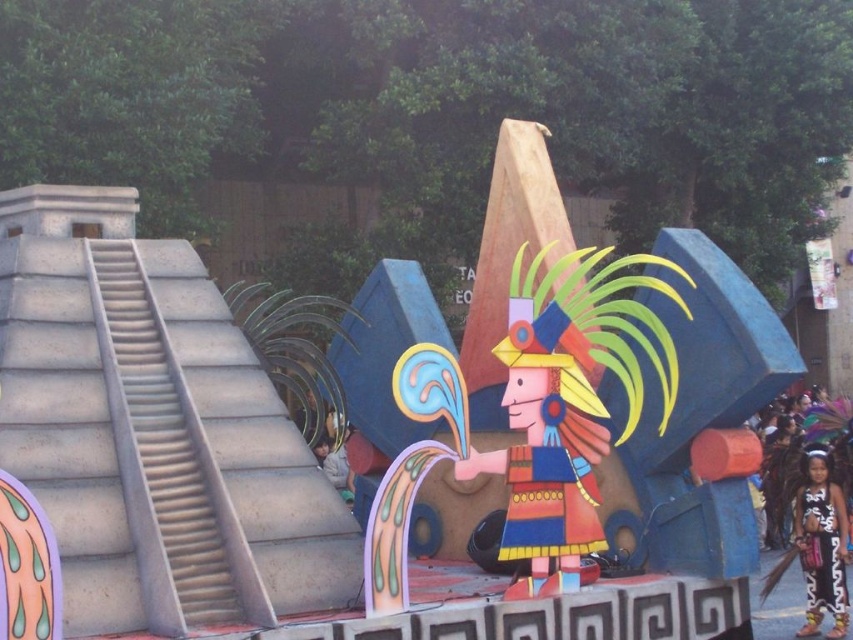
Question: Is black and white costume at center thinner than matte gray jacket at center?

Choices:
 (A) no
 (B) yes

Answer: (A)

Question: Which point is farther to the camera?

Choices:
 (A) (834, 609)
 (B) (782, 577)

Answer: (B)

Question: Among these objects, which one is farthest from the camera?

Choices:
 (A) black and white costume at center
 (B) wooden painted figure at center
 (C) black leather dress at lower right

Answer: (C)

Question: Can you confirm if black leather dress at lower right is wider than matte gray jacket at center?

Choices:
 (A) no
 (B) yes

Answer: (A)

Question: Estimate the real-world distances between objects in this image. Which object is closer to the wooden painted figure at center?

Choices:
 (A) black and white costume at center
 (B) matte gray jacket at center
 (C) black leather dress at lower right

Answer: (B)

Question: Does wooden painted figure at center appear on the left side of black and white costume at center?

Choices:
 (A) no
 (B) yes

Answer: (B)